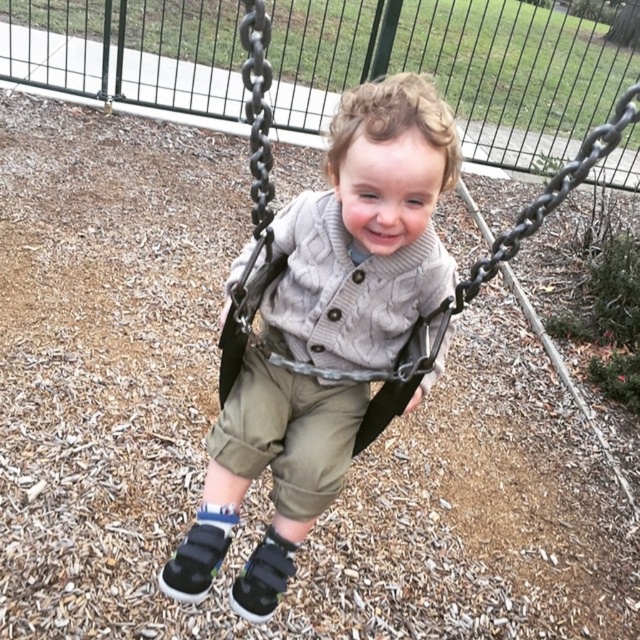
You are standing in the park and want to place a small flag exactly halfway between the point at coordinates point (458, 284) and the point at coordinates point (312, 492). Will the flag be closer to the swing set or the fence?

The flag placed halfway between point (458, 284) and point (312, 492) will be closer to the swing set because point (458, 284) is closer to the camera than point (312, 492), indicating it is physically nearer to the swing set area.

You are standing at the center of the park and see a knitted sweater at center. What is located at the point with coordinates (365, 230)?

The knitted sweater at center is located at point (365, 230).

Based on the photo, you are a fashion designer observing a child playing in a park. You notice the knitted sweater at center and the khaki cotton pants at center. How far apart are these two clothing items on the child?

The knitted sweater at center and khaki cotton pants at center are 5.62 centimeters apart from each other.